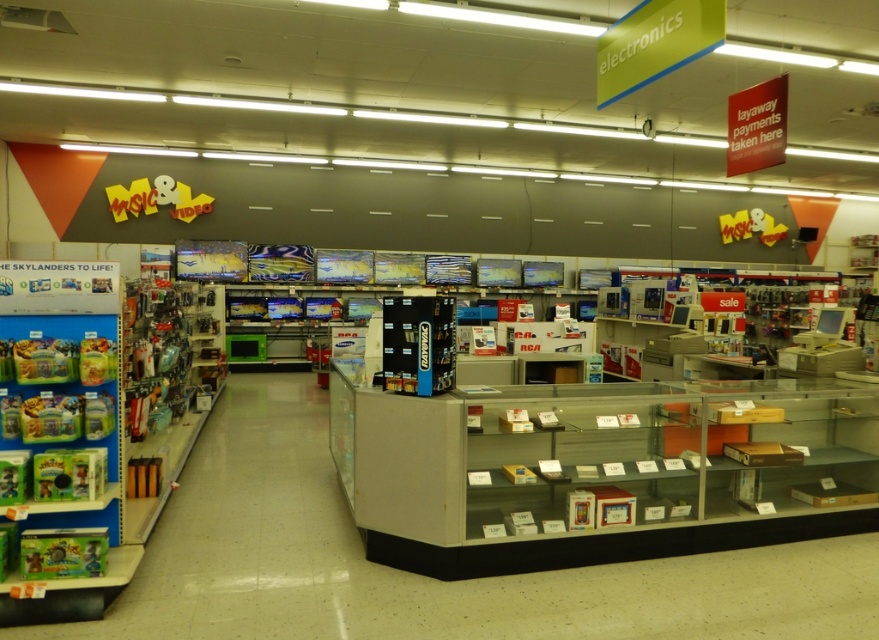
Who is positioned more to the left, clear plastic display case at center or green plastic toy at left?

green plastic toy at left is more to the left.

Does point (769, 461) lie behind point (49, 332)?

Yes, point (769, 461) is farther from viewer.

This screenshot has width=879, height=640. I want to click on clear plastic display case at center, so click(597, 470).